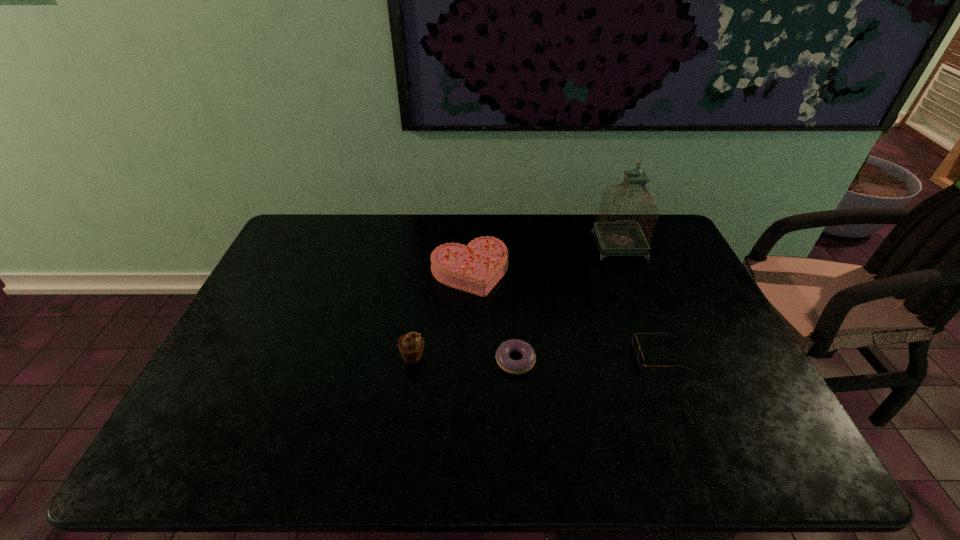
Locate an element on the screen. vacant space located on the front-facing side of the sunglasses is located at coordinates (544, 354).

At what (x,y) coordinates should I click in order to perform the action: click on free region located 0.210m on the left of the doughnut. Please return your answer as a coordinate pair (x, y). The image size is (960, 540). Looking at the image, I should click on (415, 361).

You are a GUI agent. You are given a task and a screenshot of the screen. Output one action in this format:
    pyautogui.click(x=<x>, y=<y>)
    Task: Click on the birdcage that is positioned at the far edge
    
    Given the screenshot: What is the action you would take?
    pyautogui.click(x=625, y=236)

Where is `cake located at the far edge`? cake located at the far edge is located at coordinates (476, 268).

At what (x,y) coordinates should I click in order to perform the action: click on birdcage that is at the right edge. Please return your answer as a coordinate pair (x, y). This screenshot has width=960, height=540. Looking at the image, I should click on (625, 236).

The image size is (960, 540). What are the coordinates of `sunglasses that is at the right edge` in the screenshot? It's located at (635, 343).

At what (x,y) coordinates should I click in order to perform the action: click on object positioned at the far right corner. Please return your answer as a coordinate pair (x, y). Looking at the image, I should click on (625, 236).

Locate an element on the screen. vacant space at the far edge of the desktop is located at coordinates (368, 253).

This screenshot has width=960, height=540. I want to click on free space at the left edge of the desktop, so click(x=213, y=387).

In the image, there is a desktop. Identify the location of vacant space at the right edge. This screenshot has width=960, height=540. (708, 404).